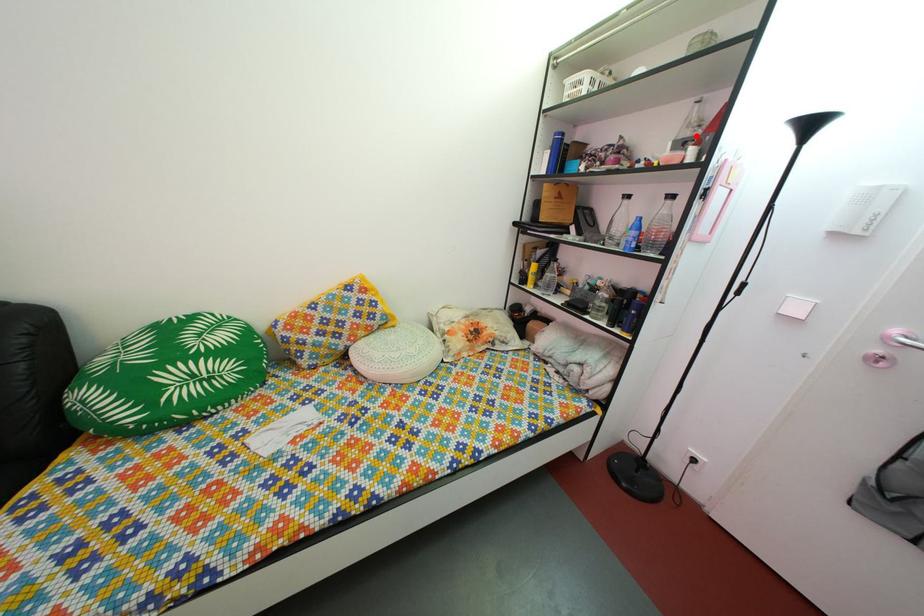
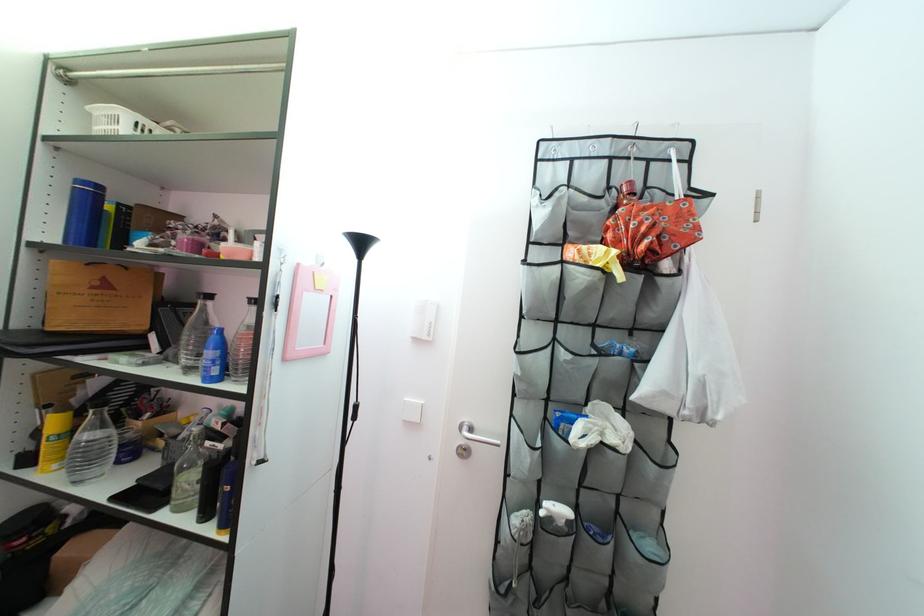
Question: I am providing you with two images of the same scene from different viewpoints. A red point is marked on the first image. Is the red point's position out of view in image 2?

Choices:
 (A) Yes
 (B) No

Answer: (A)